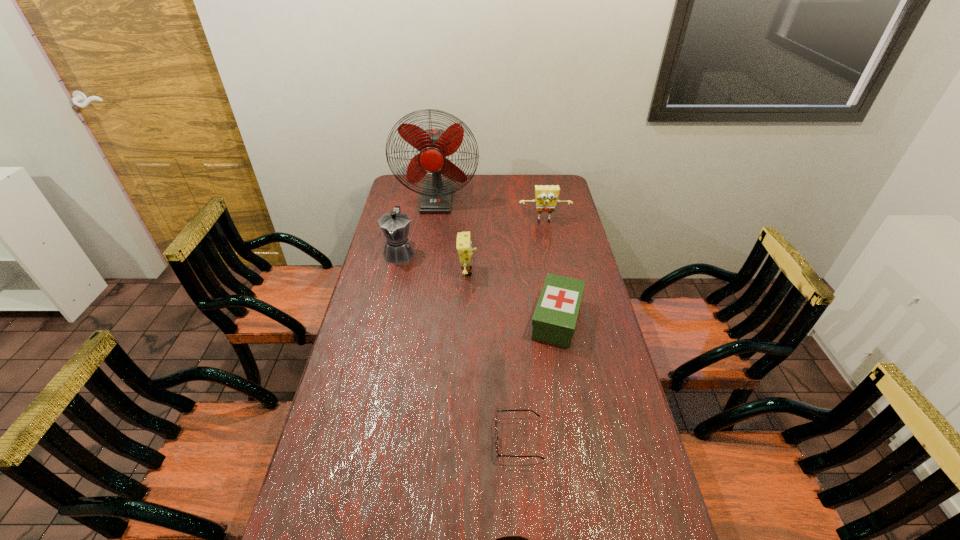
The width and height of the screenshot is (960, 540). Find the location of `free space that satisfies the following two spatial constraints: 1. at the spout of the first-aid kit; 2. on the left side of the coffeepot`. free space that satisfies the following two spatial constraints: 1. at the spout of the first-aid kit; 2. on the left side of the coffeepot is located at coordinates (385, 319).

Locate an element on the screen. This screenshot has width=960, height=540. vacant region that satisfies the following two spatial constraints: 1. on the back side of the third nearest object; 2. on the face of the left sponge is located at coordinates (548, 272).